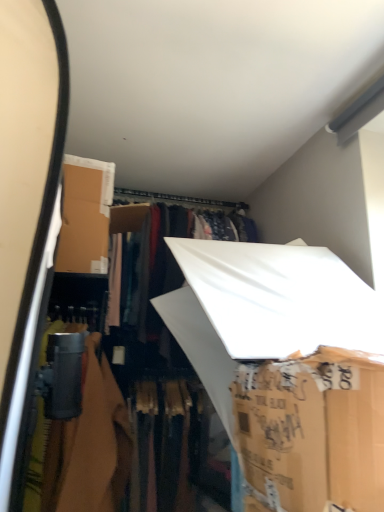
Describe the element at coordinates (312, 430) in the screenshot. This screenshot has width=384, height=512. I see `white cardboard box at lower right, acting as the 2th storage box starting from the back` at that location.

In order to face white cardboard box at lower right, acting as the 2th storage box starting from the back, should I rotate leftwards or rightwards?

A 21.910 degree turn to the right will do.

Identify the location of white cardboard box at lower right, acting as the 2th storage box starting from the back. Image resolution: width=384 pixels, height=512 pixels. (312, 430).

You are a GUI agent. You are given a task and a screenshot of the screen. Output one action in this format:
    pyautogui.click(x=<x>, y=<y>)
    Task: Click on the white cardboard box at center, which is the 2th storage box from front to back
    
    Given the screenshot: What is the action you would take?
    pyautogui.click(x=287, y=367)

Image resolution: width=384 pixels, height=512 pixels. Describe the element at coordinates (287, 367) in the screenshot. I see `white cardboard box at center, which ranks as the 1th storage box in back-to-front order` at that location.

Where is `white cardboard box at lower right, acting as the 2th storage box starting from the back`? The width and height of the screenshot is (384, 512). white cardboard box at lower right, acting as the 2th storage box starting from the back is located at coordinates (312, 430).

From the picture: Considering the relative positions of white cardboard box at center, which ranks as the 1th storage box in back-to-front order, and white cardboard box at lower right, acting as the 2th storage box starting from the back, in the image provided, is white cardboard box at center, which ranks as the 1th storage box in back-to-front order, to the left of white cardboard box at lower right, acting as the 2th storage box starting from the back, from the viewer's perspective?

Yes, white cardboard box at center, which ranks as the 1th storage box in back-to-front order, is to the left of white cardboard box at lower right, acting as the 2th storage box starting from the back.

Is white cardboard box at center, which is the 2th storage box from front to back, positioned in front of white cardboard box at lower right, which is the first storage box in front-to-back order?

No, the depth of white cardboard box at center, which is the 2th storage box from front to back, is greater than that of white cardboard box at lower right, which is the first storage box in front-to-back order.

Which is further, (349,347) or (301,409)?

Point (349,347)

From the image's perspective, which one is positioned higher, white cardboard box at center, which ranks as the 1th storage box in back-to-front order, or white cardboard box at lower right, acting as the 2th storage box starting from the back?

white cardboard box at center, which ranks as the 1th storage box in back-to-front order, is shown above in the image.

From a real-world perspective, is white cardboard box at center, which is the 2th storage box from front to back, above or below white cardboard box at lower right, acting as the 2th storage box starting from the back?

white cardboard box at center, which is the 2th storage box from front to back, is situated higher than white cardboard box at lower right, acting as the 2th storage box starting from the back, in the real world.

Considering the relative sizes of white cardboard box at center, which is the 2th storage box from front to back, and white cardboard box at lower right, acting as the 2th storage box starting from the back, in the image provided, is white cardboard box at center, which is the 2th storage box from front to back, thinner than white cardboard box at lower right, acting as the 2th storage box starting from the back,?

Incorrect, the width of white cardboard box at center, which is the 2th storage box from front to back, is not less than that of white cardboard box at lower right, acting as the 2th storage box starting from the back.

Considering the relative sizes of white cardboard box at center, which ranks as the 1th storage box in back-to-front order, and white cardboard box at lower right, which is the first storage box in front-to-back order, in the image provided, is white cardboard box at center, which ranks as the 1th storage box in back-to-front order, taller than white cardboard box at lower right, which is the first storage box in front-to-back order,?

Yes.

Is white cardboard box at center, which ranks as the 1th storage box in back-to-front order, bigger than white cardboard box at lower right, which is the first storage box in front-to-back order?

Correct, white cardboard box at center, which ranks as the 1th storage box in back-to-front order, is larger in size than white cardboard box at lower right, which is the first storage box in front-to-back order.

Is white cardboard box at center, which ranks as the 1th storage box in back-to-front order, surrounding white cardboard box at lower right, acting as the 2th storage box starting from the back?

No.

Is white cardboard box at center, which is the 2th storage box from front to back, touching white cardboard box at lower right, acting as the 2th storage box starting from the back?

No, white cardboard box at center, which is the 2th storage box from front to back, is not making contact with white cardboard box at lower right, acting as the 2th storage box starting from the back.

Is white cardboard box at center, which ranks as the 1th storage box in back-to-front order, oriented towards white cardboard box at lower right, acting as the 2th storage box starting from the back?

Yes, white cardboard box at center, which ranks as the 1th storage box in back-to-front order, is aimed at white cardboard box at lower right, acting as the 2th storage box starting from the back.

How much distance is there between white cardboard box at center, which ranks as the 1th storage box in back-to-front order, and white cardboard box at lower right, which is the first storage box in front-to-back order?

white cardboard box at center, which ranks as the 1th storage box in back-to-front order, and white cardboard box at lower right, which is the first storage box in front-to-back order, are 7.00 inches apart from each other.

Identify the location of storage box that appears below the white cardboard box at center, which ranks as the 1th storage box in back-to-front order (from the image's perspective). click(312, 430).

Which object is positioned more to the left, white cardboard box at lower right, acting as the 2th storage box starting from the back, or white cardboard box at center, which is the 2th storage box from front to back?

white cardboard box at center, which is the 2th storage box from front to back, is more to the left.

Which object is more forward, white cardboard box at lower right, acting as the 2th storage box starting from the back, or white cardboard box at center, which is the 2th storage box from front to back?

white cardboard box at lower right, acting as the 2th storage box starting from the back, is closer to the camera.

Which is closer, (330,454) or (347,467)?

Point (330,454) is positioned farther from the camera compared to point (347,467).

From the image's perspective, does white cardboard box at lower right, which is the first storage box in front-to-back order, appear lower than white cardboard box at center, which is the 2th storage box from front to back?

Yes.

From the picture: From a real-world perspective, is white cardboard box at lower right, acting as the 2th storage box starting from the back, physically located above or below white cardboard box at center, which is the 2th storage box from front to back?

Clearly, from a real-world perspective, white cardboard box at lower right, acting as the 2th storage box starting from the back, is below white cardboard box at center, which is the 2th storage box from front to back.

Considering the relative sizes of white cardboard box at lower right, acting as the 2th storage box starting from the back, and white cardboard box at center, which is the 2th storage box from front to back, in the image provided, is white cardboard box at lower right, acting as the 2th storage box starting from the back, thinner than white cardboard box at center, which is the 2th storage box from front to back,?

Yes, white cardboard box at lower right, acting as the 2th storage box starting from the back, is thinner than white cardboard box at center, which is the 2th storage box from front to back.

Which of these two, white cardboard box at lower right, which is the first storage box in front-to-back order, or white cardboard box at center, which ranks as the 1th storage box in back-to-front order, stands shorter?

With less height is white cardboard box at lower right, which is the first storage box in front-to-back order.

Can you confirm if white cardboard box at lower right, which is the first storage box in front-to-back order, is bigger than white cardboard box at center, which is the 2th storage box from front to back?

No.

Which is correct: white cardboard box at lower right, acting as the 2th storage box starting from the back, is inside white cardboard box at center, which is the 2th storage box from front to back, or outside of it?

white cardboard box at lower right, acting as the 2th storage box starting from the back, cannot be found inside white cardboard box at center, which is the 2th storage box from front to back.

Can you see white cardboard box at lower right, which is the first storage box in front-to-back order, touching white cardboard box at center, which is the 2th storage box from front to back?

white cardboard box at lower right, which is the first storage box in front-to-back order, is not next to white cardboard box at center, which is the 2th storage box from front to back, and they're not touching.

Is white cardboard box at lower right, which is the first storage box in front-to-back order, positioned with its back to white cardboard box at center, which is the 2th storage box from front to back?

No, white cardboard box at center, which is the 2th storage box from front to back, is not at the back of white cardboard box at lower right, which is the first storage box in front-to-back order.

What's the angular difference between white cardboard box at lower right, acting as the 2th storage box starting from the back, and white cardboard box at center, which ranks as the 1th storage box in back-to-front order,'s facing directions?

98.4 degrees separate the facing orientations of white cardboard box at lower right, acting as the 2th storage box starting from the back, and white cardboard box at center, which ranks as the 1th storage box in back-to-front order.

The image size is (384, 512). I want to click on storage box located behind the white cardboard box at lower right, acting as the 2th storage box starting from the back, so click(x=287, y=367).

The height and width of the screenshot is (512, 384). In order to click on storage box behind the white cardboard box at lower right, acting as the 2th storage box starting from the back in this screenshot , I will do click(287, 367).

Where is `storage box above the white cardboard box at lower right, which is the first storage box in front-to-back order (from the image's perspective)`? Image resolution: width=384 pixels, height=512 pixels. storage box above the white cardboard box at lower right, which is the first storage box in front-to-back order (from the image's perspective) is located at coordinates (287, 367).